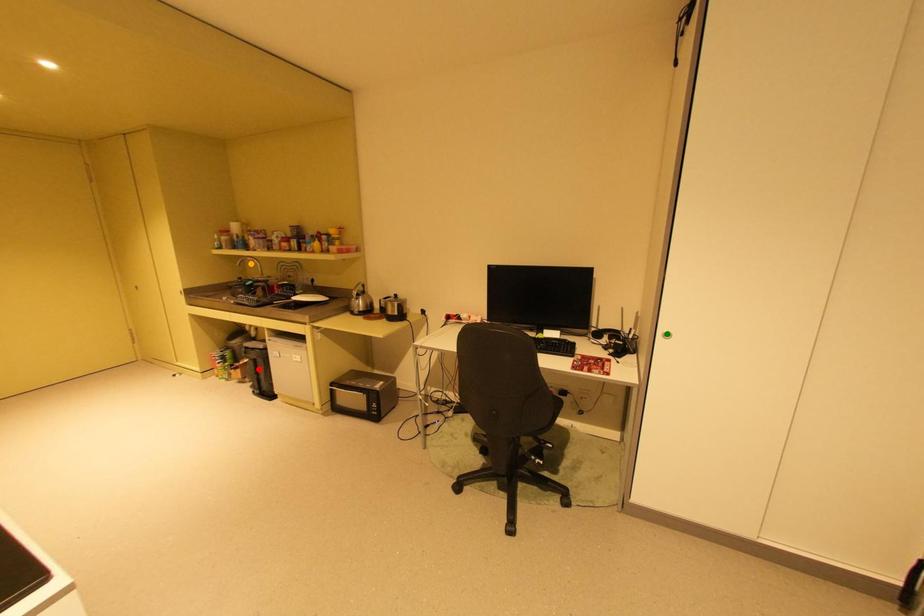
From the picture: Order these from farthest to nearest:
A) red point
B) orange point
C) green point

orange point, red point, green point